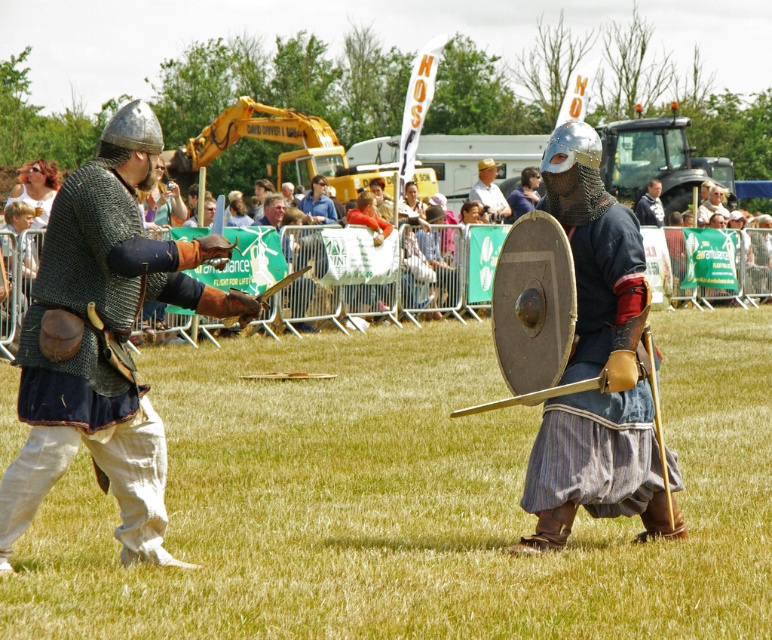
You are a spectator standing at the edge of the grassy field watching the medieval combat demonstration. You notice a point marked at coordinates (408, 500). Which object in the scene is this point located on?

The point at coordinates (408, 500) is located on the matte black sword at center.

You are a knight in training observing the combat demonstration. You need to choose between the matte black sword at center and the matte silver shield at center for your next training session. Which one has a greater width?

The matte black sword at center has a greater width than the matte silver shield at center according to the description.

You are a spectator standing behind the metal barricades watching the medieval combat demonstration. You notice two points marked in the scene. Which point is closer to you, point (390,545) or point (561,470)?

Point (390,545) is further to the viewer than point (561,470), so the closer point to you is point (561,470).